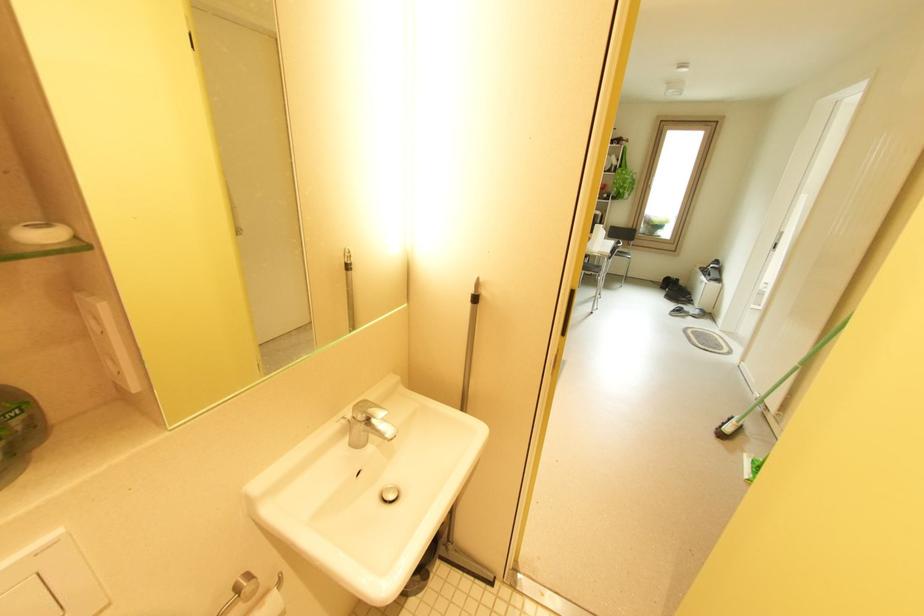
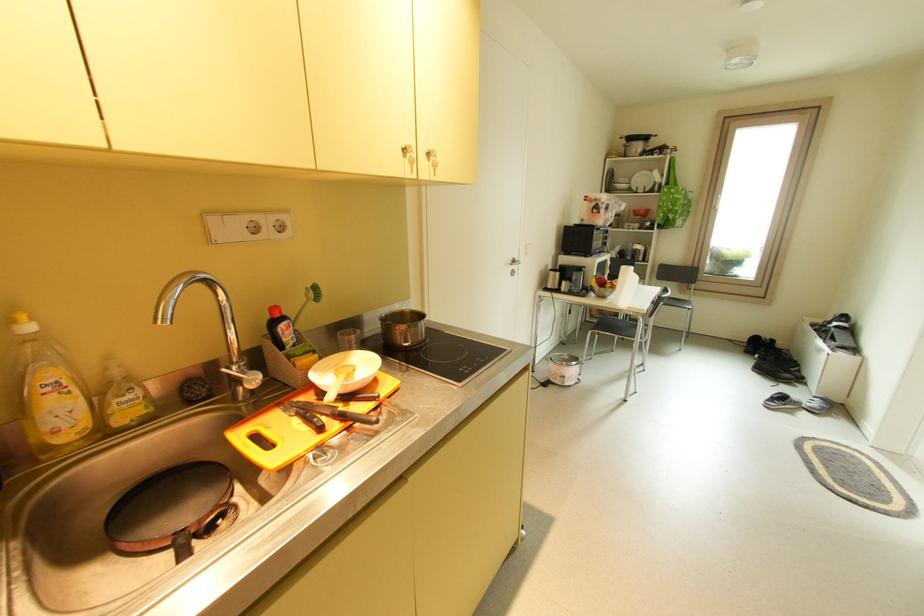
In a continuous first-person perspective shot, in which direction is the camera moving?

The cameraman walked toward right, forward.